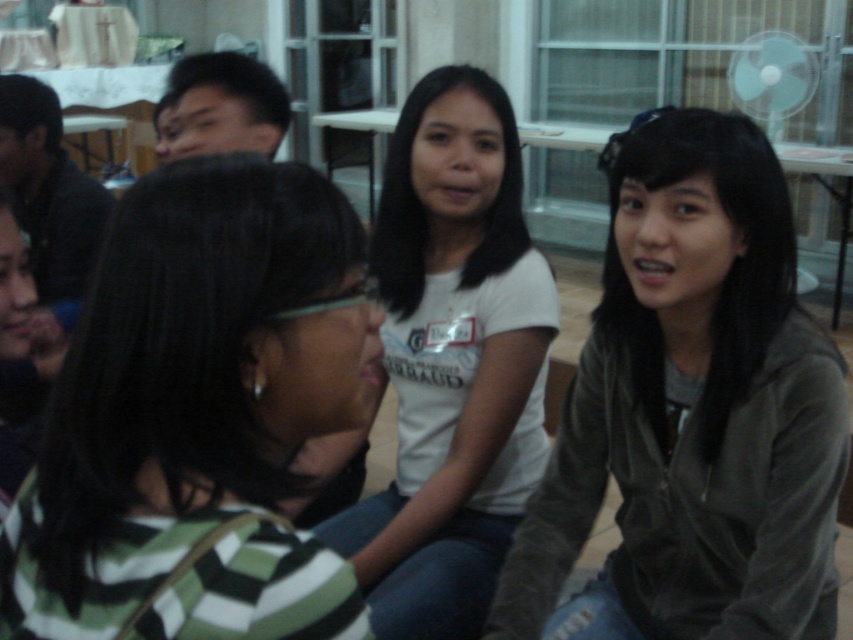
Question: Can you confirm if green striped shirt at center is bigger than white matte shirt at center?

Choices:
 (A) yes
 (B) no

Answer: (B)

Question: Which point is closer to the camera taking this photo?

Choices:
 (A) (401, 166)
 (B) (735, 160)
 (C) (245, 499)

Answer: (C)

Question: Which object is closer to the camera taking this photo?

Choices:
 (A) green striped shirt at center
 (B) white matte shirt at center

Answer: (A)

Question: Estimate the real-world distances between objects in this image. Which object is closer to the matte gray jacket at right?

Choices:
 (A) green striped shirt at center
 (B) white matte shirt at center

Answer: (B)

Question: Is green striped shirt at center positioned before white matte shirt at center?

Choices:
 (A) no
 (B) yes

Answer: (B)

Question: Is green striped shirt at center bigger than matte gray jacket at right?

Choices:
 (A) no
 (B) yes

Answer: (A)